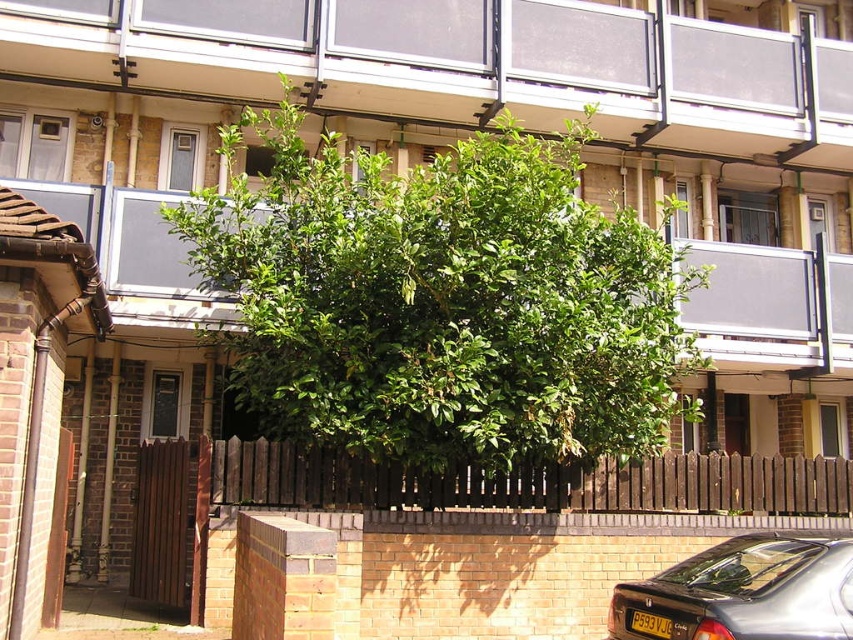
Question: Can you confirm if glass panels at upper center is bigger than metallic gray car at lower right?

Choices:
 (A) no
 (B) yes

Answer: (A)

Question: Which of the following is the farthest from the observer?

Choices:
 (A) (479, 365)
 (B) (457, 116)
 (C) (729, 600)

Answer: (B)

Question: Observing the image, what is the correct spatial positioning of glass panels at upper center in reference to metallic gray car at lower right?

Choices:
 (A) right
 (B) left

Answer: (A)

Question: Estimate the real-world distances between objects in this image. Which object is farther from the green leafy tree at center?

Choices:
 (A) metallic gray car at lower right
 (B) glass panels at upper center

Answer: (B)

Question: Is green leafy tree at center positioned behind glass panels at upper center?

Choices:
 (A) yes
 (B) no

Answer: (B)

Question: Which point is farther from the camera taking this photo?

Choices:
 (A) (370, 102)
 (B) (384, 419)
 (C) (811, 616)

Answer: (A)